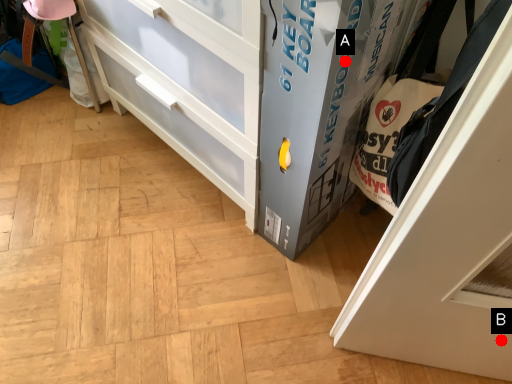
Question: Two points are circled on the image, labeled by A and B beside each circle. Which of the following is the closest to the observer?

Choices:
 (A) A is closer
 (B) B is closer

Answer: (A)